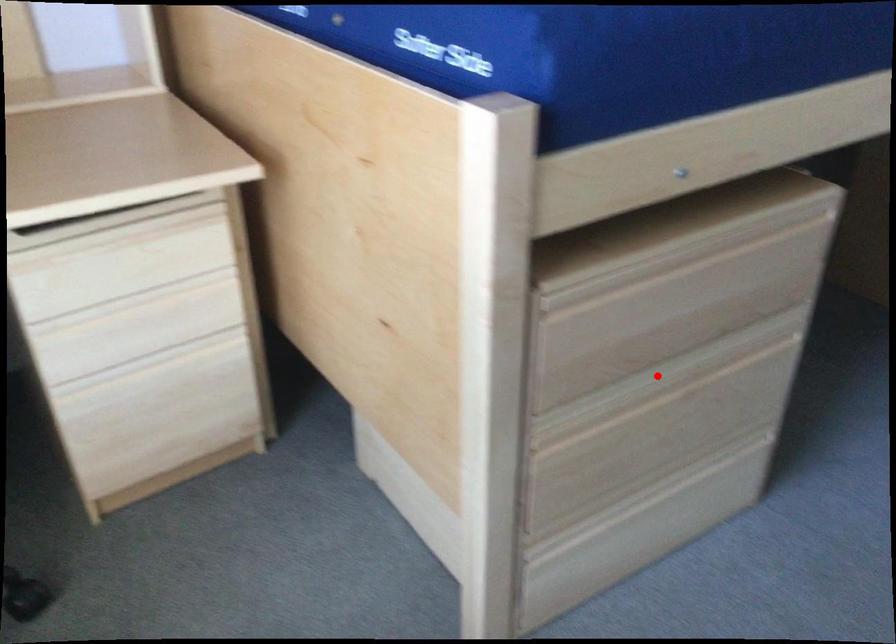
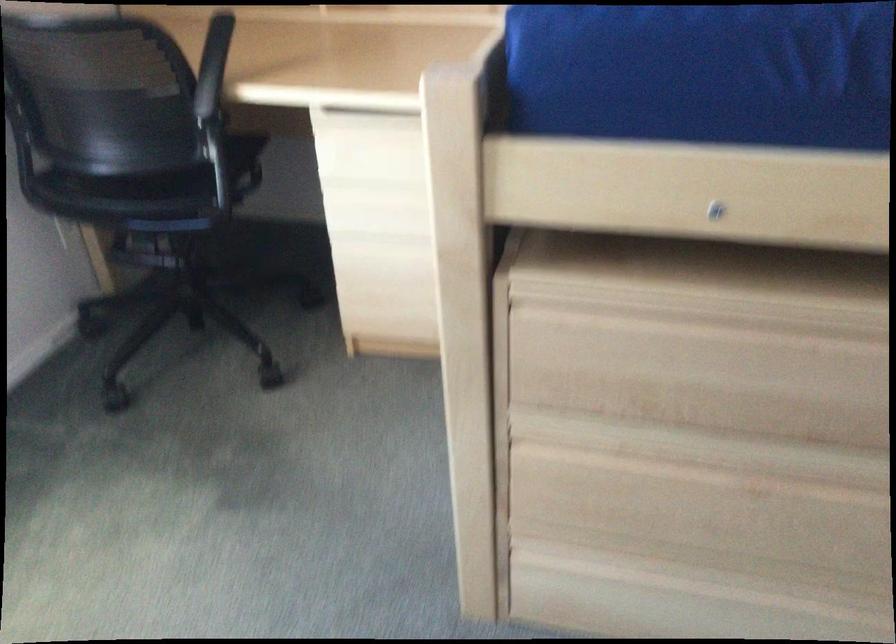
Question: I am providing you with two images of the same scene from different viewpoints. A red point is shown in image1. For the corresponding object point in image2, is it positioned nearer or farther from the camera?

Choices:
 (A) Nearer
 (B) Farther

Answer: (A)